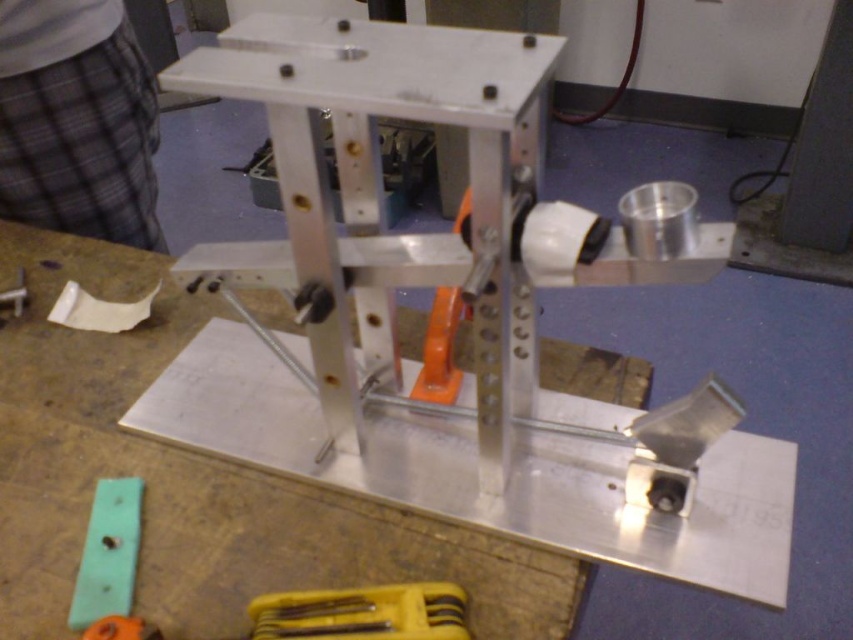
You are an engineer working on the metallic mechanical device on the workbench. You need to locate the yellow plastic tool at lower center. According to the coordinates provided, where exactly is the yellow plastic tool positioned relative to the workbench?

The yellow plastic tool at lower center is located at coordinates point 0.959 on the x axis and 0.426 on the y axis relative to the workbench.

You are an engineer inspecting the workbench. You need to pick up the green plastic ruler at lower left and the matte plastic ruler at lower left. Which ruler should you reach for first to grab the one closer to you?

The green plastic ruler at lower left is closer to the viewer than the matte plastic ruler at lower left, so you should reach for the green plastic ruler at lower left first.

You are a technician working on the workbench and need to access both the yellow plastic tool at lower center and the matte plastic ruler at lower left. Which object would you need to move first to reach the other?

The yellow plastic tool at lower center is in front of the matte plastic ruler at lower left, so you would need to move the yellow plastic tool at lower center first to access the matte plastic ruler at lower left.